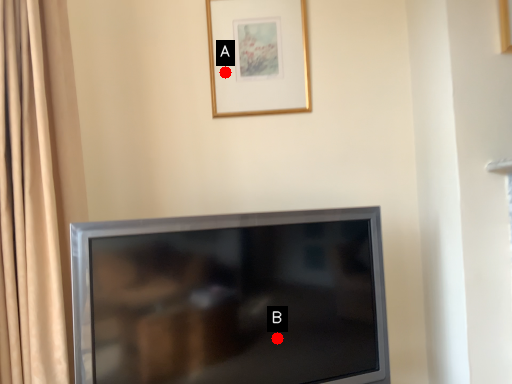
Question: Two points are circled on the image, labeled by A and B beside each circle. Which point is closer to the camera?

Choices:
 (A) A is closer
 (B) B is closer

Answer: (B)